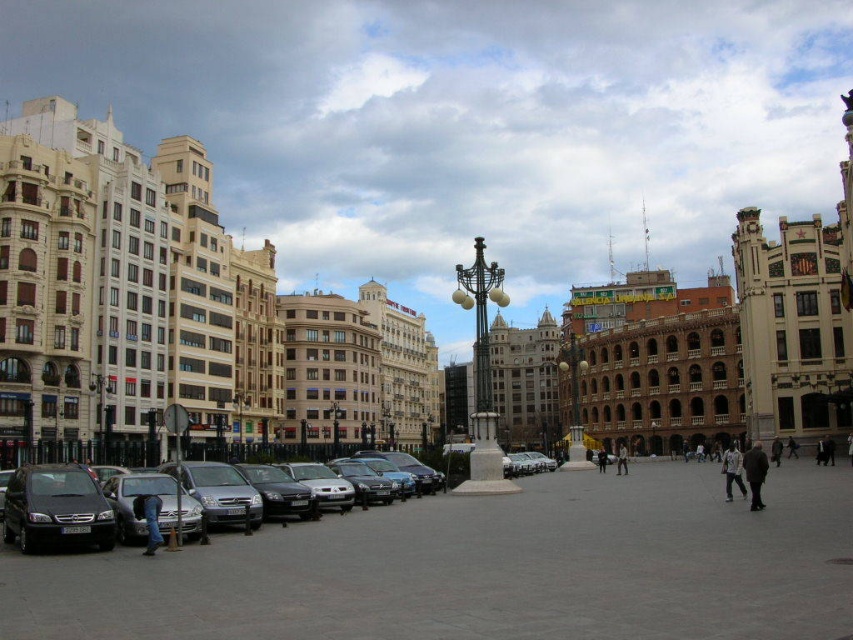
Is the position of dark gray jacket at center less distant than that of dark gray coat at center right?

No, it is not.

Which is more to the left, dark gray jacket at center or dark gray coat at center right?

dark gray jacket at center is more to the left.

Locate an element on the screen. This screenshot has width=853, height=640. dark gray jacket at center is located at coordinates [x=621, y=458].

What do you see at coordinates (755, 474) in the screenshot?
I see `dark gray coat at lower right` at bounding box center [755, 474].

How distant is dark gray coat at lower right from dark gray jacket at center?

83.62 feet

Which is behind, point (755, 493) or point (625, 472)?

The point (625, 472) is behind.

Find the location of a particular element. The image size is (853, 640). dark gray coat at lower right is located at coordinates (755, 474).

Is dark gray jacket at center above black leather jacket at center?

No.

Based on the photo, measure the distance between dark gray jacket at center and camera.

dark gray jacket at center is 81.21 meters away from camera.

Between point (621, 468) and point (602, 472), which one is positioned behind?

The point (621, 468) is more distant.

Locate an element on the screen. This screenshot has width=853, height=640. dark gray jacket at center is located at coordinates (621, 458).